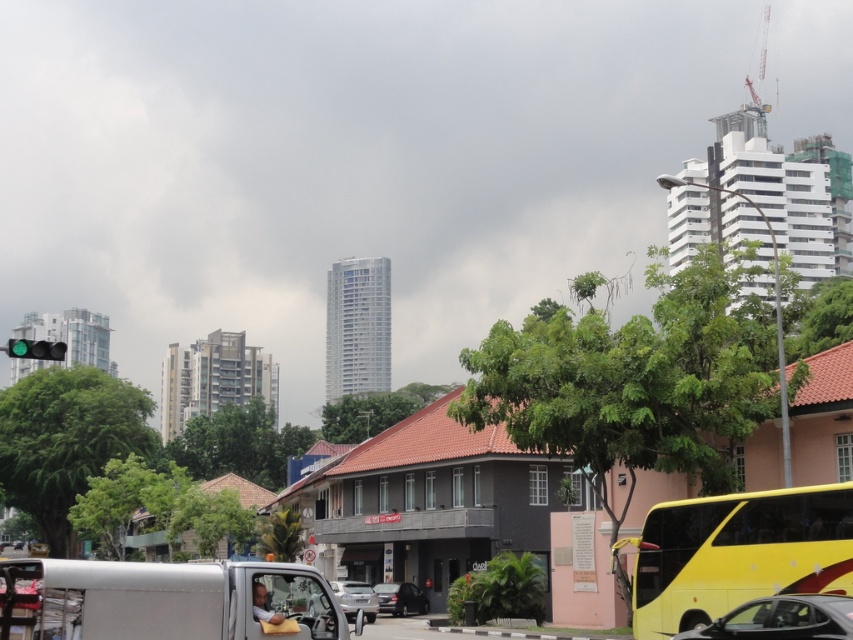
Who is higher up, yellow matte/decorative bus at lower right or metallic silver car at lower right?

yellow matte/decorative bus at lower right is above.

Which is in front, point (770, 534) or point (802, 611)?

Point (802, 611) is more forward.

The height and width of the screenshot is (640, 853). I want to click on yellow matte/decorative bus at lower right, so click(738, 554).

Is metallic silver car at lower right positioned in front of silver metallic car at center?

That is True.

Who is shorter, metallic silver car at lower right or silver metallic car at center?

metallic silver car at lower right is shorter.

Does point (791, 600) come farther from viewer compared to point (367, 605)?

No, it is not.

Find the location of a particular element. The width and height of the screenshot is (853, 640). metallic silver car at lower right is located at coordinates (781, 620).

Does silver metallic car at center lie behind green glass traffic light at upper left?

Yes, silver metallic car at center is further from the viewer.

Is point (376, 609) farther from viewer compared to point (26, 340)?

Yes, point (376, 609) is farther from viewer.

Between point (357, 589) and point (32, 353), which one is positioned behind?

The point (357, 589) is more distant.

The width and height of the screenshot is (853, 640). What are the coordinates of `silver metallic car at center` in the screenshot? It's located at (355, 598).